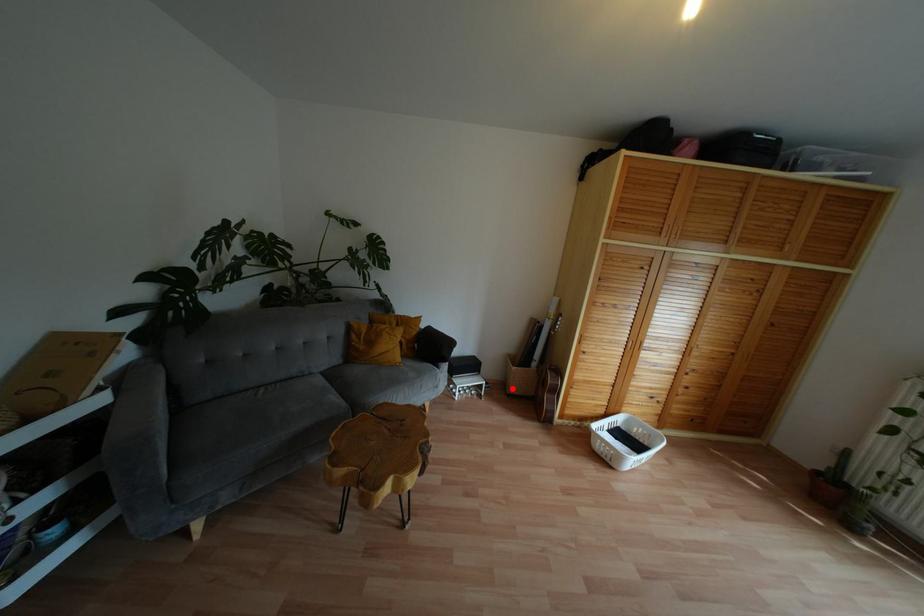
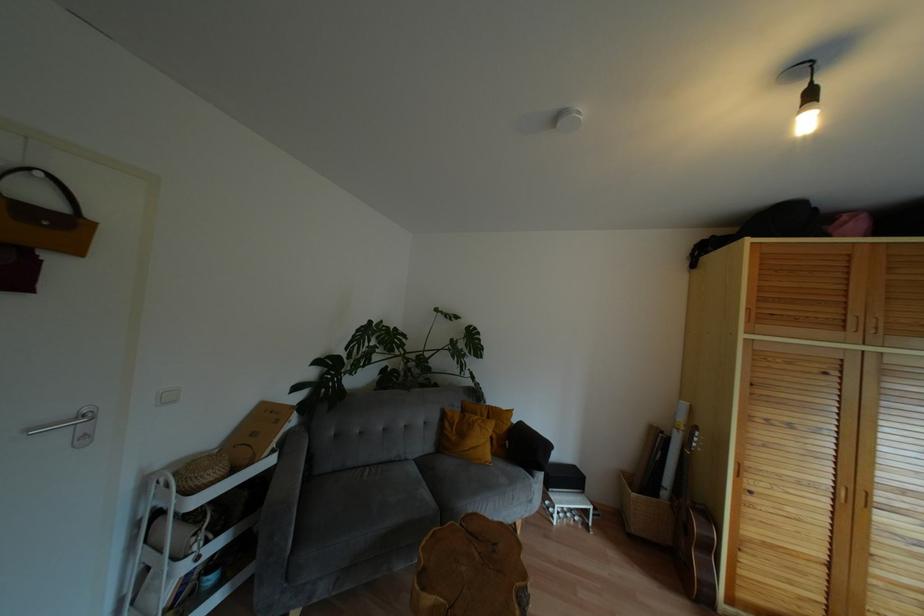
Question: I am providing you with two images of the same scene from different viewpoints. A red point is shown in image1. For the corresponding object point in image2, is it positioned nearer or farther from the camera?

Choices:
 (A) Nearer
 (B) Farther

Answer: (B)